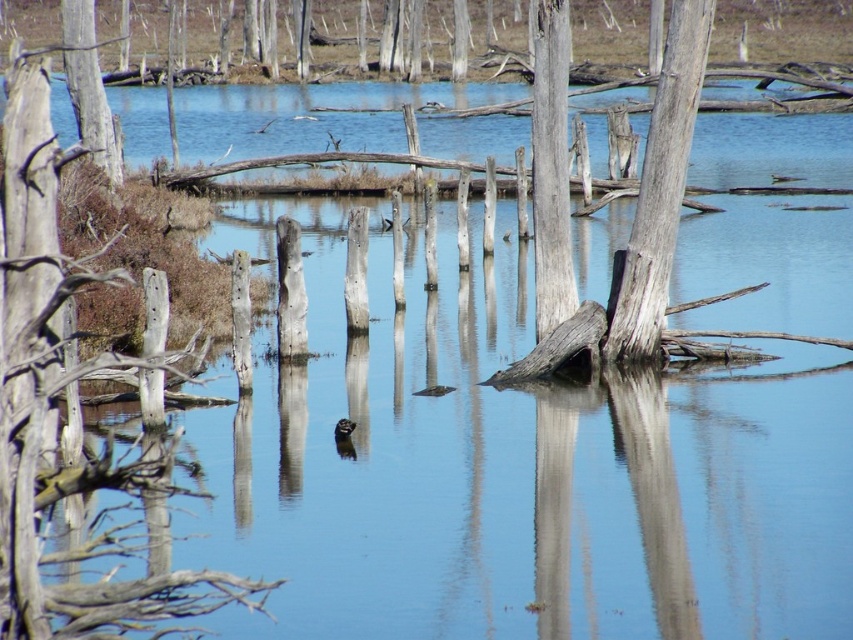
Looking at this image, you are a photographer standing at the edge of the water. You want to capture a photo where the gray rough wood at center and the smooth gray tree trunk at upper left are both visible. Based on their positions, which object will appear closer to the bottom of the photo?

The gray rough wood at center is located below the smooth gray tree trunk at upper left, so it will appear closer to the bottom of the photo.

You are standing at the edge of the water in the scene. If you want to reach the gray wood tree trunk at center, which direction should you move in relation to your current position?

The gray wood tree trunk at center is located at coordinates point (660, 188), so you should move towards the center of the water to reach it.